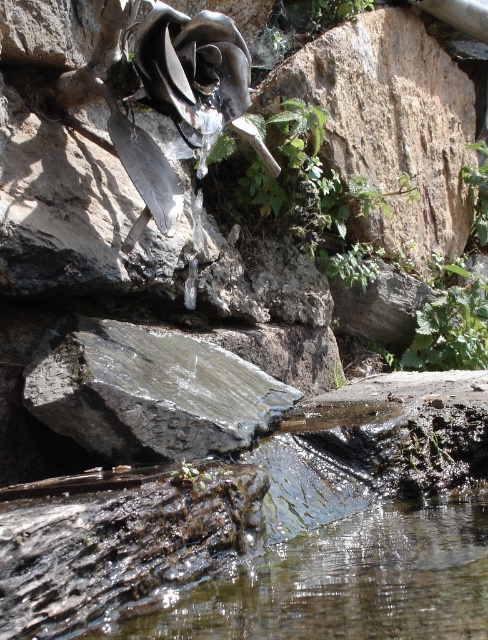
Question: Which point is closer to the camera?

Choices:
 (A) clear water at lower center
 (B) gray rough rock at center

Answer: (A)

Question: Estimate the real-world distances between objects in this image. Which object is farther from the clear water at lower center?

Choices:
 (A) gray rough rock at center
 (B) rough stone wall at upper right

Answer: (B)

Question: Is clear water at lower center closer to camera compared to gray rough rock at center?

Choices:
 (A) no
 (B) yes

Answer: (B)

Question: Where is clear water at lower center located in relation to gray rough rock at center in the image?

Choices:
 (A) left
 (B) right

Answer: (B)

Question: Can you confirm if rough stone wall at upper right is smaller than gray rough rock at center?

Choices:
 (A) yes
 (B) no

Answer: (B)

Question: Which object is the farthest from the rough stone wall at upper right?

Choices:
 (A) clear water at lower center
 (B) gray rough rock at center

Answer: (A)